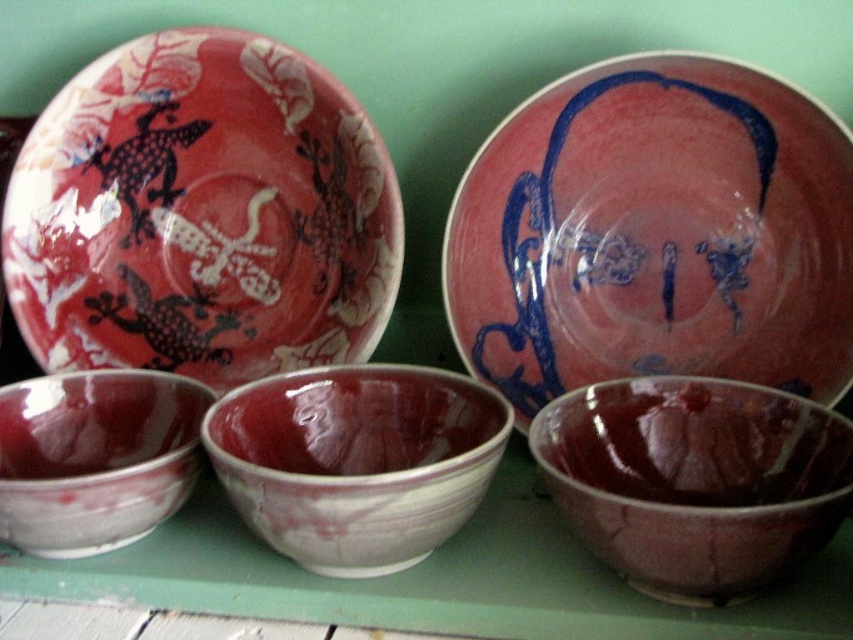
You are arranging these bowls on a shelf. The maroon glossy bowls at center is heavier than the matte ceramic bowl at center. If you want to prevent the shelf from tipping, which bowl should you place closer to the center of the shelf?

The maroon glossy bowls at center is larger and heavier, so placing it closer to the center of the shelf will help balance the weight and prevent tipping.

You are arranging items on a shelf and need to stack the matte red plate at upper left and the matte ceramic bowl at center vertically. Which one should you place at the bottom to ensure stability?

You should place the matte red plate at upper left at the bottom because it is taller than the matte ceramic bowl at center, providing a more stable base.